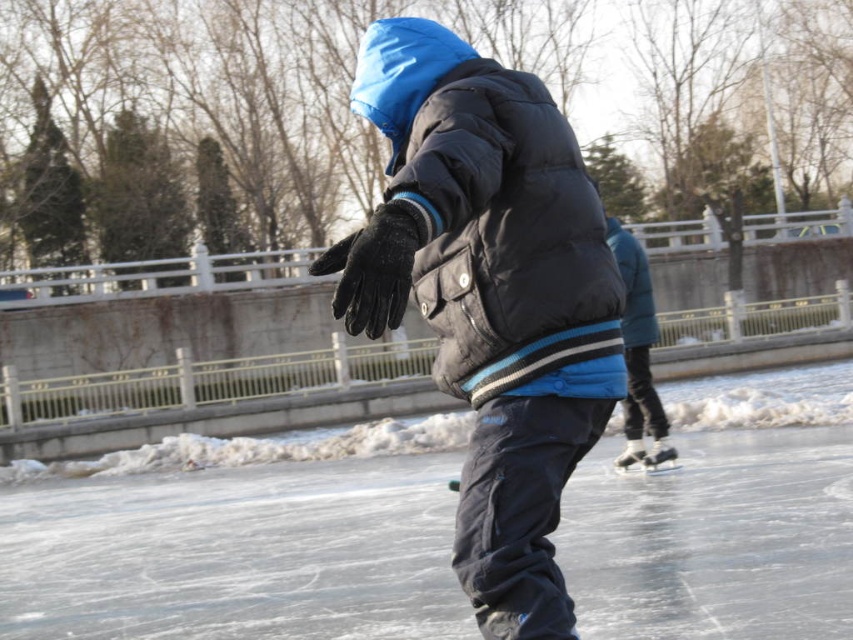
Question: Is matte black jacket at center wider than black puffy jacket at center?

Choices:
 (A) no
 (B) yes

Answer: (B)

Question: Can you confirm if matte black jacket at center is positioned to the right of black puffy jacket at center?

Choices:
 (A) no
 (B) yes

Answer: (A)

Question: Can you confirm if matte black jacket at center is bigger than black puffy jacket at center?

Choices:
 (A) yes
 (B) no

Answer: (A)

Question: Among these points, which one is farthest from the camera?

Choices:
 (A) (547, 268)
 (B) (548, 282)

Answer: (A)

Question: Which point appears closest to the camera in this image?

Choices:
 (A) (444, 124)
 (B) (444, 77)

Answer: (A)